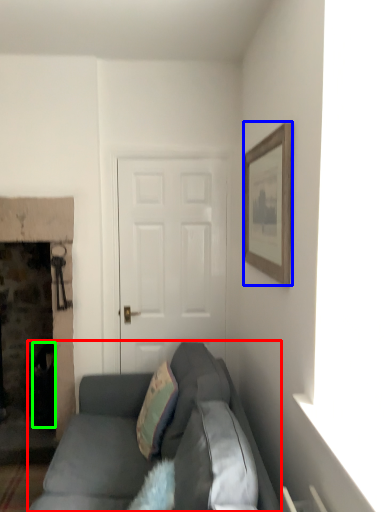
Question: Which is nearer to the studio couch (highlighted by a red box)? picture frame (highlighted by a blue box) or trash bin/can (highlighted by a green box).

Choices:
 (A) picture frame
 (B) trash bin/can

Answer: (B)